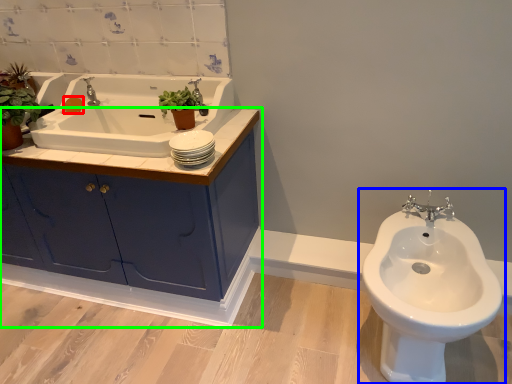
Question: Which object is positioned farthest from soap (highlighted by a red box)? Select from toilet (highlighted by a blue box) and bathroom cabinet (highlighted by a green box).

Choices:
 (A) toilet
 (B) bathroom cabinet

Answer: (A)